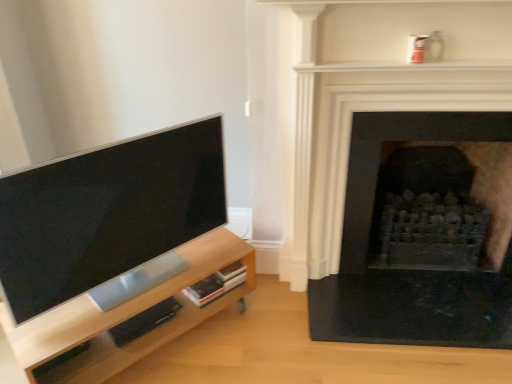
Question: From the image's perspective, is black stone fireplace at right, which appears as the 1th fireplace when viewed from the front, on top of light wood entertainment center at left?

Choices:
 (A) yes
 (B) no

Answer: (A)

Question: Could you tell me if black stone fireplace at right, marked as the 2th fireplace in a back-to-front arrangement, is facing light wood entertainment center at left?

Choices:
 (A) yes
 (B) no

Answer: (B)

Question: From a real-world perspective, does black stone fireplace at right, which appears as the 1th fireplace when viewed from the front, sit lower than light wood entertainment center at left?

Choices:
 (A) no
 (B) yes

Answer: (A)

Question: Is black stone fireplace at right, marked as the 2th fireplace in a back-to-front arrangement, bigger than light wood entertainment center at left?

Choices:
 (A) yes
 (B) no

Answer: (A)

Question: Does black stone fireplace at right, marked as the 2th fireplace in a back-to-front arrangement, have a lesser width compared to light wood entertainment center at left?

Choices:
 (A) no
 (B) yes

Answer: (B)

Question: Can you confirm if black stone fireplace at right, marked as the 2th fireplace in a back-to-front arrangement, is positioned to the left of light wood entertainment center at left?

Choices:
 (A) yes
 (B) no

Answer: (B)

Question: Is light wood entertainment center at left outside of matte black tv at left?

Choices:
 (A) no
 (B) yes

Answer: (B)

Question: From a real-world perspective, is light wood entertainment center at left located higher than matte black tv at left?

Choices:
 (A) no
 (B) yes

Answer: (A)

Question: Does light wood entertainment center at left have a greater height compared to matte black tv at left?

Choices:
 (A) no
 (B) yes

Answer: (A)

Question: Is light wood entertainment center at left positioned in front of matte black tv at left?

Choices:
 (A) yes
 (B) no

Answer: (B)

Question: From a real-world perspective, does light wood entertainment center at left sit lower than matte black tv at left?

Choices:
 (A) yes
 (B) no

Answer: (A)

Question: Does light wood entertainment center at left have a lesser height compared to matte black tv at left?

Choices:
 (A) no
 (B) yes

Answer: (B)

Question: Can you confirm if black stone fireplace at right, the first fireplace positioned from the back, is smaller than black stone fireplace at right, marked as the 2th fireplace in a back-to-front arrangement?

Choices:
 (A) yes
 (B) no

Answer: (B)